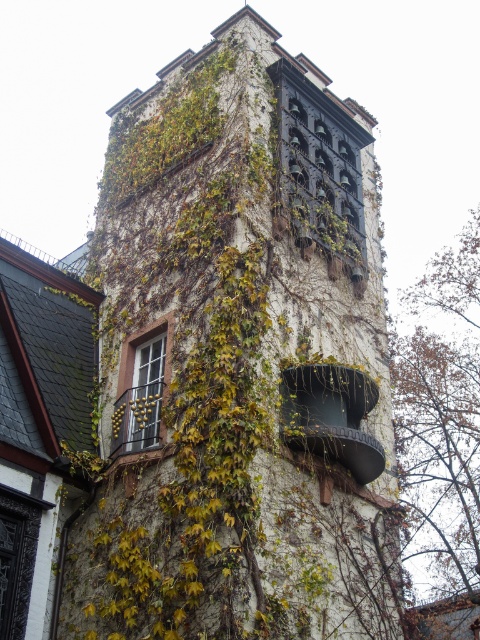
You are standing at the base of the tower and looking up. There are two points marked on the tower wall. The first point is at coordinates point (454, 540) and the second is at point (155, 342). Which point is closer to your line of sight when you look directly ahead?

Point (155, 342) is closer to your line of sight because it is in front of point (454, 540), which is behind it.